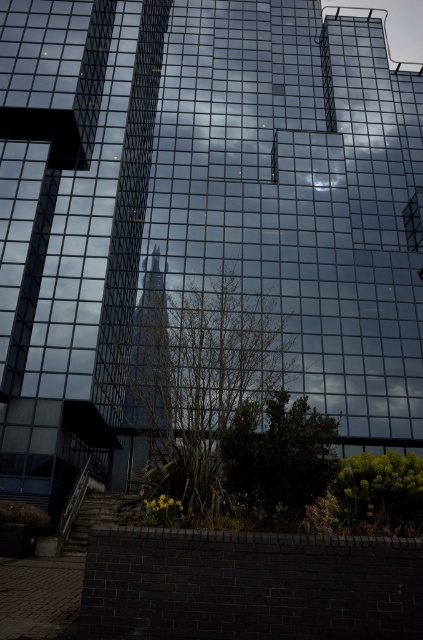
Which is above, green leafy tree at lower center or green leafy bush at lower right?

green leafy tree at lower center is higher up.

Looking at this image, does green leafy tree at lower center have a greater width compared to green leafy bush at lower right?

No.

Who is more forward, (324, 442) or (382, 508)?

Point (324, 442) is more forward.

Locate an element on the screen. green leafy tree at lower center is located at coordinates (279, 456).

Between green leafy tree at center and green leafy bush at lower right, which one is positioned higher?

green leafy bush at lower right is higher up.

Who is more forward, (x=187, y=422) or (x=351, y=509)?

Point (x=351, y=509)

The width and height of the screenshot is (423, 640). What are the coordinates of `green leafy tree at center` in the screenshot? It's located at (195, 381).

I want to click on green leafy tree at center, so click(x=195, y=381).

Based on the photo, can you confirm if green leafy tree at center is positioned above green leafy tree at lower center?

Incorrect, green leafy tree at center is not positioned above green leafy tree at lower center.

Is green leafy tree at center shorter than green leafy tree at lower center?

Incorrect, green leafy tree at center's height does not fall short of green leafy tree at lower center's.

Does point (178, 486) come farther from viewer compared to point (320, 481)?

Yes, it is behind point (320, 481).

Image resolution: width=423 pixels, height=640 pixels. In order to click on green leafy tree at center in this screenshot , I will do `click(195, 381)`.